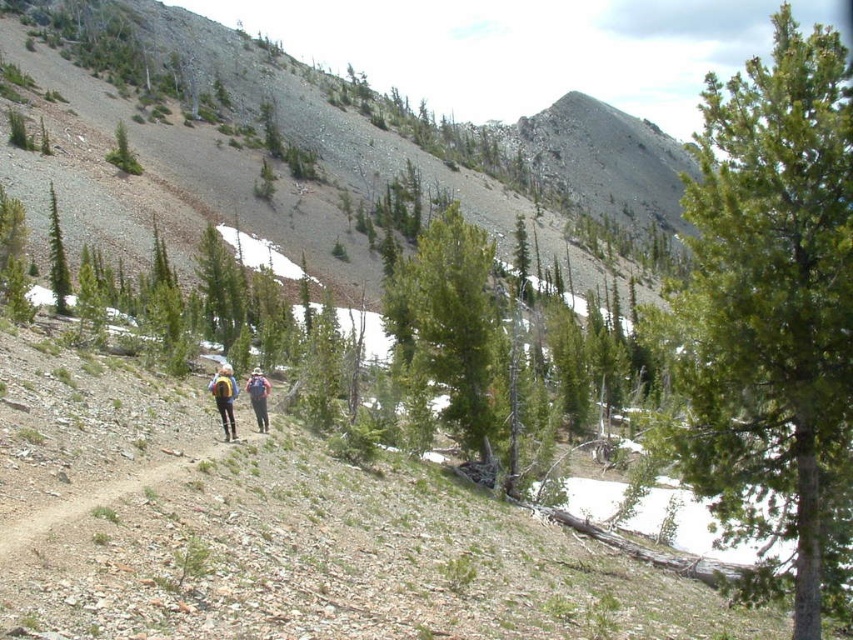
Question: Does matte yellow backpack at center have a smaller size compared to blue fabric backpack at center?

Choices:
 (A) no
 (B) yes

Answer: (B)

Question: Which object is positioned closest to the green textured tree at center?

Choices:
 (A) green needle-like at center
 (B) green matte tree at left
 (C) dirt path at lower center
 (D) blue fabric backpack at center

Answer: (D)

Question: Which object appears closest to the camera in this image?

Choices:
 (A) green matte tree at left
 (B) blue fabric backpack at center
 (C) matte yellow backpack at center
 (D) yellow backpack at center

Answer: (C)

Question: Does green textured tree at center have a lesser width compared to yellow backpack at center?

Choices:
 (A) no
 (B) yes

Answer: (A)

Question: Is green textured tree at center to the right of dirt path at lower center from the viewer's perspective?

Choices:
 (A) yes
 (B) no

Answer: (A)

Question: Which object is the closest to the green needle-like at center?

Choices:
 (A) dirt path at lower center
 (B) blue fabric backpack at center

Answer: (A)